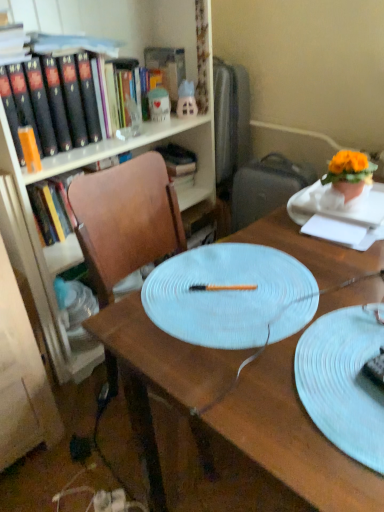
The image size is (384, 512). What do you see at coordinates (291, 437) in the screenshot?
I see `wooden desk at center` at bounding box center [291, 437].

Locate an element on the screen. The height and width of the screenshot is (512, 384). wooden desk at center is located at coordinates (291, 437).

What do you see at coordinates (334, 230) in the screenshot? This screenshot has height=512, width=384. I see `white paper at upper right` at bounding box center [334, 230].

Find the location of a particular element. matte white ceramic mug at upper center, the first toy positioned from the left is located at coordinates (159, 104).

The width and height of the screenshot is (384, 512). Describe the element at coordinates (375, 368) in the screenshot. I see `chocolate cake at center` at that location.

Where is `gray fabric suitcase at right`? gray fabric suitcase at right is located at coordinates (266, 187).

Is point (322, 380) more distant than point (180, 110)?

No, it is not.

Is white textured plate at center situated inside white glossy house at upper center, the 2th toy when ordered from left to right, or outside?

white textured plate at center is spatially situated outside white glossy house at upper center, the 2th toy when ordered from left to right.

From the image's perspective, which is above, white textured plate at center or white glossy house at upper center, the 2th toy when ordered from left to right?

white glossy house at upper center, the 2th toy when ordered from left to right, is shown above in the image.

Considering the relative sizes of white textured plate at center and white glossy house at upper center, the 2th toy when ordered from left to right, in the image provided, is white textured plate at center bigger than white glossy house at upper center, the 2th toy when ordered from left to right,?

Correct, white textured plate at center is larger in size than white glossy house at upper center, the 2th toy when ordered from left to right.

Consider the image. Is orange matte book at left, positioned as the 1th book in front-to-back order, beside matte wood bookcase at upper left?

No, orange matte book at left, positioned as the 1th book in front-to-back order, is not in contact with matte wood bookcase at upper left.

Which of these two, orange matte book at left, which is the 2th book from back to front, or matte wood bookcase at upper left, is smaller?

orange matte book at left, which is the 2th book from back to front.

Which point is more forward, (84, 141) or (10, 218)?

Positioned in front is point (10, 218).

From a real-world perspective, which is physically above, orange matte book at left, which appears as the first book when viewed from the left, or matte wood bookcase at upper left?

orange matte book at left, which appears as the first book when viewed from the left, from a real-world perspective.

Is white glossy house at upper center, the 2th toy when ordered from left to right, with wooden desk at center?

No, white glossy house at upper center, the 2th toy when ordered from left to right, is not next to wooden desk at center.

From the image's perspective, is white glossy house at upper center, the 2th toy when ordered from left to right, positioned above or below wooden desk at center?

white glossy house at upper center, the 2th toy when ordered from left to right, is above wooden desk at center.

From their relative heights in the image, would you say white textured plate at center is taller or shorter than chocolate cake at center?

white textured plate at center is taller than chocolate cake at center.

Is white textured plate at center not near chocolate cake at center?

No, white textured plate at center is not far from chocolate cake at center.

Consider the image. What's the angular difference between white textured plate at center and chocolate cake at center's facing directions?

There is a 19.7-degree angle between the facing directions of white textured plate at center and chocolate cake at center.

From a real-world perspective, does white textured plate at center sit lower than chocolate cake at center?

Yes, from a real-world perspective, white textured plate at center is under chocolate cake at center.

Is orange matte flower pot at upper right not near gray fabric suitcase at right?

No.

Is orange matte flower pot at upper right not within gray fabric suitcase at right?

Yes, orange matte flower pot at upper right is located beyond the bounds of gray fabric suitcase at right.

Considering the sizes of orange matte flower pot at upper right and gray fabric suitcase at right in the image, is orange matte flower pot at upper right wider or thinner than gray fabric suitcase at right?

In the image, orange matte flower pot at upper right appears to be more narrow than gray fabric suitcase at right.

From a real-world perspective, which object rests below the other?

gray fabric suitcase at right.

Between matte wood bookcase at upper left and gray fabric suitcase at right, which one has smaller size?

gray fabric suitcase at right.

Is gray fabric suitcase at right completely or partially inside matte wood bookcase at upper left?

No, matte wood bookcase at upper left does not contain gray fabric suitcase at right.

From the image's perspective, which is above, matte wood bookcase at upper left or gray fabric suitcase at right?

matte wood bookcase at upper left, from the image's perspective.

Is point (173, 14) positioned in front of point (291, 167)?

Yes, it is in front of point (291, 167).

Is gray fabric suitcase at right oriented away from orange matte book at left, the 2th book positioned from the right?

gray fabric suitcase at right is not turned away from orange matte book at left, the 2th book positioned from the right.

From the image's perspective, is gray fabric suitcase at right located beneath orange matte book at left, positioned as the 1th book in front-to-back order?

Correct, gray fabric suitcase at right appears lower than orange matte book at left, positioned as the 1th book in front-to-back order, in the image.

Is there a large distance between gray fabric suitcase at right and orange matte book at left, the 2th book positioned from the right?

Actually, gray fabric suitcase at right and orange matte book at left, the 2th book positioned from the right, are a little close together.

The height and width of the screenshot is (512, 384). Find the location of `toy that is the 2nd one when counting upward from the white textured plate at center (from the image's perspective)`. toy that is the 2nd one when counting upward from the white textured plate at center (from the image's perspective) is located at coordinates (186, 100).

You are a GUI agent. You are given a task and a screenshot of the screen. Output one action in this format:
    pyautogui.click(x=<x>, y=<y>)
    Task: Click on the bookcase on the right of orange matte book at left, the 2th book positioned from the right
    This screenshot has height=512, width=384.
    Given the screenshot: What is the action you would take?
    pyautogui.click(x=74, y=240)

From the image, which object appears to be nearer to wooden desk at center, wooden chair at center or orange matte book at left, which appears as the first book when viewed from the left?

wooden chair at center is closer to wooden desk at center.

Which object lies further to the anchor point matte wood bookcase at upper left, orange matte flower pot at upper right or wooden desk at center?

orange matte flower pot at upper right lies further to matte wood bookcase at upper left than the other object.

Considering their positions, is matte wood bookcase at upper left positioned closer to orange matte flower pot at upper right than gray fabric suitcase at right?

gray fabric suitcase at right.

From the image, which object appears to be nearer to gray fabric suitcase at right, wooden chair at center or white glossy house at upper center, positioned as the first toy in right-to-left order?

white glossy house at upper center, positioned as the first toy in right-to-left order, lies closer to gray fabric suitcase at right than the other object.

When comparing their distances from white textured plate at center, does matte white ceramic mug at upper center, which is the 2th toy from right to left, or matte wood bookcase at upper left seem closer?

The object closer to white textured plate at center is matte wood bookcase at upper left.

From the image, which object appears to be farther from white glossy house at upper center, the 2th toy when ordered from left to right, orange matte book at left, which is the 2th book from back to front, or gray fabric suitcase at right?

orange matte book at left, which is the 2th book from back to front, is further to white glossy house at upper center, the 2th toy when ordered from left to right.

Estimate the real-world distances between objects in this image. Which object is further from matte wood bookcase at upper left, gray fabric suitcase at right or wooden desk at center?

Based on the image, wooden desk at center appears to be further to matte wood bookcase at upper left.

Which object lies nearer to the anchor point orange matte book at left, which appears as the first book when viewed from the left, white textured plate at center or chocolate cake at center?

Based on the image, white textured plate at center appears to be nearer to orange matte book at left, which appears as the first book when viewed from the left.

This screenshot has width=384, height=512. In order to click on toy between white paper at upper right and white glossy house at upper center, positioned as the first toy in right-to-left order, from front to back in this screenshot , I will do `click(159, 104)`.

The width and height of the screenshot is (384, 512). What are the coordinates of `toy located between wooden desk at center and white glossy house at upper center, positioned as the first toy in right-to-left order, in the depth direction` in the screenshot? It's located at click(x=159, y=104).

You are a GUI agent. You are given a task and a screenshot of the screen. Output one action in this format:
    pyautogui.click(x=<x>, y=<y>)
    Task: Click on the chocolate cake between white textured plate at center and matte white ceramic mug at upper center, the first toy positioned from the left, along the z-axis
    This screenshot has width=384, height=512.
    Given the screenshot: What is the action you would take?
    pyautogui.click(x=375, y=368)

The image size is (384, 512). What are the coordinates of `houseplant between white paper at upper right and white glossy house at upper center, the 2th toy when ordered from left to right, along the z-axis` in the screenshot? It's located at (349, 173).